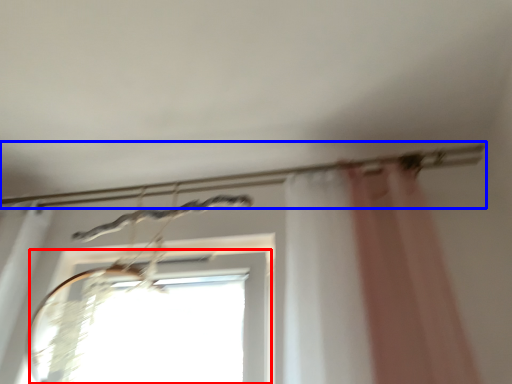
Question: Which object appears farthest to the camera in this image, window (highlighted by a red box) or clothesline (highlighted by a blue box)?

Choices:
 (A) window
 (B) clothesline

Answer: (B)